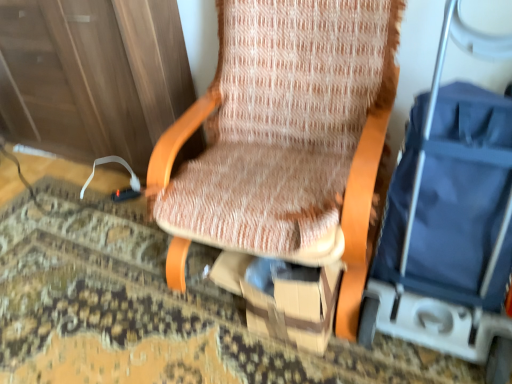
Question: Does brown cardboard box at center turn towards blue fabric baby carriage at right?

Choices:
 (A) no
 (B) yes

Answer: (A)

Question: Is blue fabric baby carriage at right a part of brown cardboard box at center?

Choices:
 (A) no
 (B) yes

Answer: (A)

Question: Does brown cardboard box at center have a greater height compared to blue fabric baby carriage at right?

Choices:
 (A) yes
 (B) no

Answer: (B)

Question: Considering the relative positions of brown cardboard box at center and blue fabric baby carriage at right in the image provided, is brown cardboard box at center in front of blue fabric baby carriage at right?

Choices:
 (A) yes
 (B) no

Answer: (B)

Question: Are brown cardboard box at center and blue fabric baby carriage at right making contact?

Choices:
 (A) yes
 (B) no

Answer: (B)

Question: From the image's perspective, is brown cardboard box at center over blue fabric baby carriage at right?

Choices:
 (A) yes
 (B) no

Answer: (B)

Question: From a real-world perspective, is blue fabric baby carriage at right over textured fabric chair at center?

Choices:
 (A) yes
 (B) no

Answer: (A)

Question: Can you confirm if blue fabric baby carriage at right is bigger than textured fabric chair at center?

Choices:
 (A) no
 (B) yes

Answer: (A)

Question: Is blue fabric baby carriage at right at the right side of textured fabric chair at center?

Choices:
 (A) no
 (B) yes

Answer: (B)

Question: Considering the relative positions of blue fabric baby carriage at right and textured fabric chair at center in the image provided, is blue fabric baby carriage at right to the left of textured fabric chair at center from the viewer's perspective?

Choices:
 (A) yes
 (B) no

Answer: (B)

Question: Is blue fabric baby carriage at right aimed at textured fabric chair at center?

Choices:
 (A) yes
 (B) no

Answer: (B)

Question: Is blue fabric baby carriage at right not near textured fabric chair at center?

Choices:
 (A) no
 (B) yes

Answer: (A)

Question: Does brown cardboard box at center have a lesser width compared to textured fabric chair at center?

Choices:
 (A) yes
 (B) no

Answer: (A)